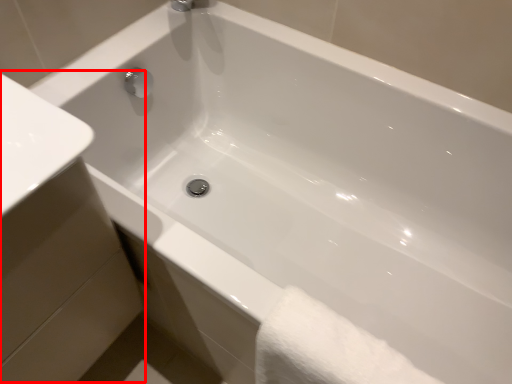
Question: From the image's perspective, what is the correct spatial positioning of sink (annotated by the red box) in reference to bath towel?

Choices:
 (A) below
 (B) above

Answer: (B)